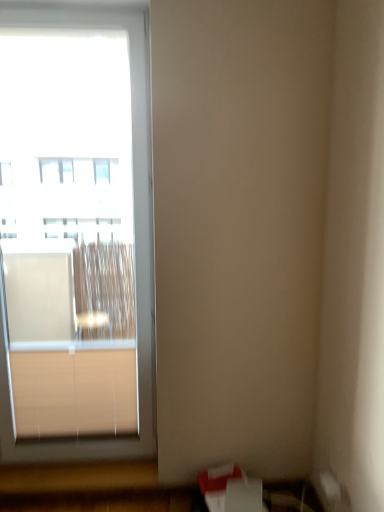
What do you see at coordinates (74, 234) in the screenshot?
I see `white matte window at upper left` at bounding box center [74, 234].

In order to face white matte window at upper left, should I rotate leftwards or rightwards?

Turn left by 16.112 degrees to look at white matte window at upper left.

Locate an element on the screen. The height and width of the screenshot is (512, 384). white matte window at upper left is located at coordinates (74, 234).

Measure the distance between point (6, 424) and camera.

Point (6, 424) is 2.27 meters away from camera.

Image resolution: width=384 pixels, height=512 pixels. Find the location of `white matte window at upper left`. white matte window at upper left is located at coordinates (74, 234).